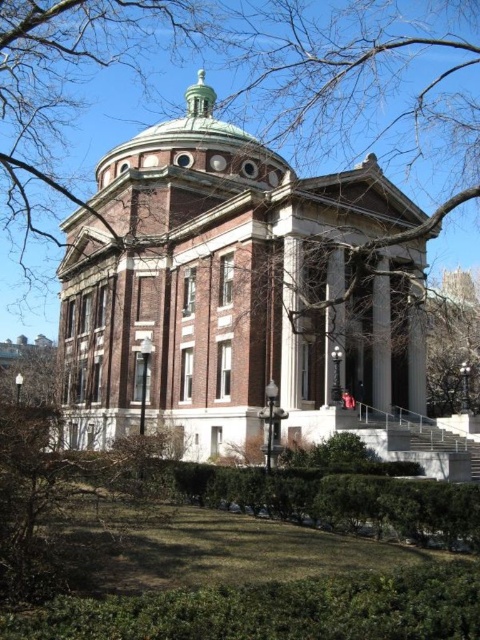
Who is positioned more to the left, green polished dome at center or white marble pillar at center?

Positioned to the left is green polished dome at center.

Does green polished dome at center appear over white marble pillar at center?

Yes, green polished dome at center is above white marble pillar at center.

Find the location of a particular element. The image size is (480, 640). green polished dome at center is located at coordinates (195, 145).

At what (x,y) coordinates should I click in order to perform the action: click on green polished dome at center. Please return your answer as a coordinate pair (x, y). The width and height of the screenshot is (480, 640). Looking at the image, I should click on (195, 145).

Can you confirm if green polished dome at center is shorter than white marble column at center?

No, green polished dome at center is not shorter than white marble column at center.

Is green polished dome at center to the right of white marble column at center from the viewer's perspective?

Incorrect, green polished dome at center is not on the right side of white marble column at center.

The height and width of the screenshot is (640, 480). What do you see at coordinates (195, 145) in the screenshot? I see `green polished dome at center` at bounding box center [195, 145].

The height and width of the screenshot is (640, 480). I want to click on green polished dome at center, so click(195, 145).

Consider the image. Is white marble pillar at center taller than white marble column at center?

Yes.

Which is above, white marble pillar at center or white marble column at center?

white marble column at center

Describe the element at coordinates (290, 324) in the screenshot. I see `white marble pillar at center` at that location.

Identify the location of white marble pillar at center. The image size is (480, 640). (290, 324).